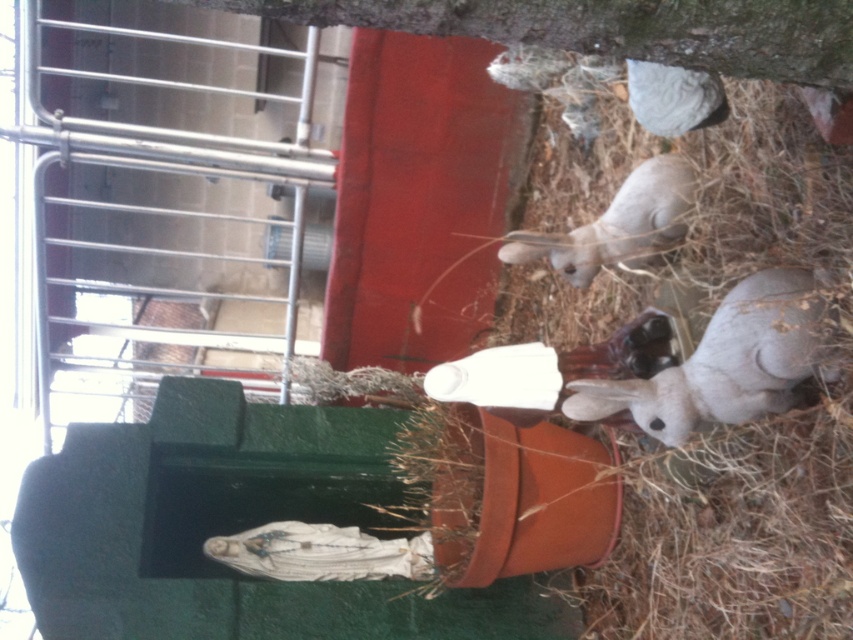
Describe the element at coordinates (724, 364) in the screenshot. I see `gray matte rabbit at lower right` at that location.

Between gray matte rabbit at lower right and fuzzy gray rabbit at lower right, which one is positioned higher?

fuzzy gray rabbit at lower right

What are the coordinates of `gray matte rabbit at lower right` in the screenshot? It's located at (724, 364).